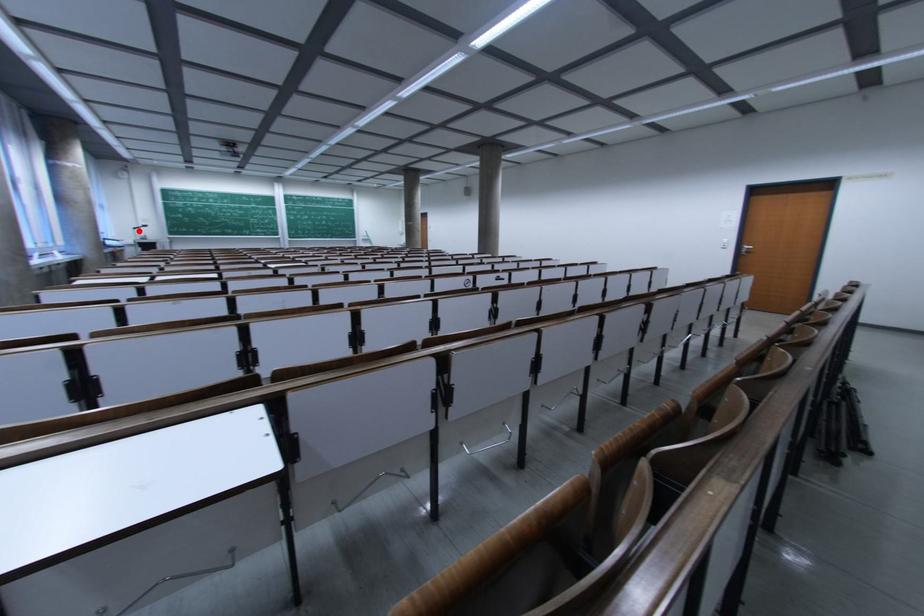
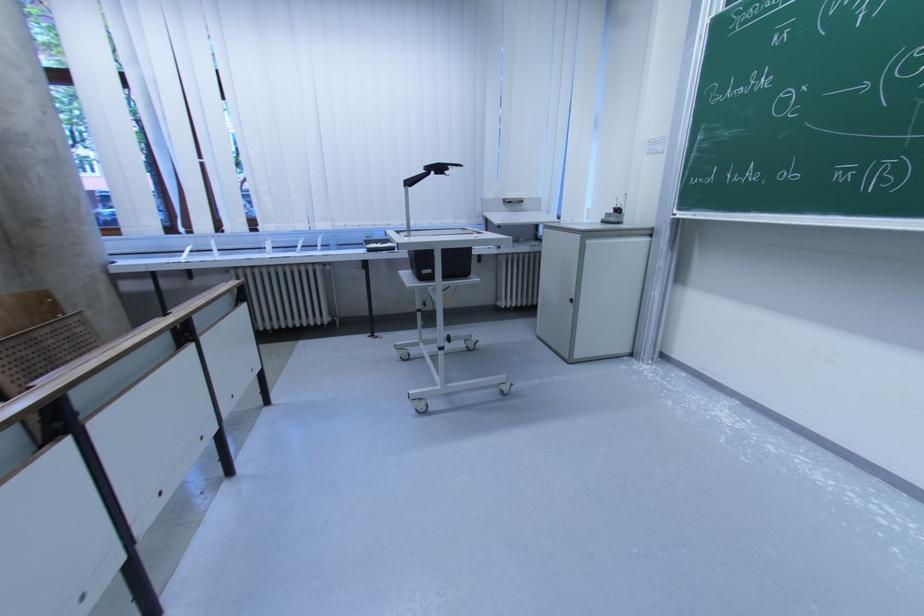
The point at the highlighted location is marked in the first image. Where is the corresponding point in the second image?

(415, 185)